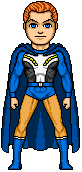
The width and height of the screenshot is (82, 172). Find the location of `sock`. sock is located at coordinates coord(64,147).